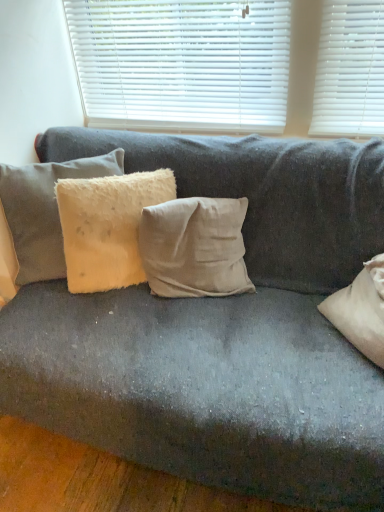
This screenshot has width=384, height=512. What do you see at coordinates (195, 247) in the screenshot?
I see `beige cotton cushion at center, which is counted as the first pillow, starting from the right` at bounding box center [195, 247].

Image resolution: width=384 pixels, height=512 pixels. What do you see at coordinates (44, 211) in the screenshot?
I see `fuzzy beige pillow at left, which appears as the 1th pillow when viewed from the left` at bounding box center [44, 211].

What do you see at coordinates (182, 64) in the screenshot? The width and height of the screenshot is (384, 512). I see `white plastic blinds at upper center` at bounding box center [182, 64].

In order to click on fuzzy beige pillow at center, the 2th pillow from the right in this screenshot , I will do `click(107, 226)`.

Looking at the image, does fuzzy beige pillow at left, which appears as the 1th pillow when viewed from the left, seem bigger or smaller compared to white plastic blinds at upper center?

fuzzy beige pillow at left, which appears as the 1th pillow when viewed from the left, is bigger than white plastic blinds at upper center.

Does point (7, 195) come behind point (143, 61)?

No, (7, 195) is in front of (143, 61).

From their relative heights in the image, would you say fuzzy beige pillow at left, the third pillow when ordered from right to left, is taller or shorter than white plastic blinds at upper center?

Clearly, fuzzy beige pillow at left, the third pillow when ordered from right to left, is shorter compared to white plastic blinds at upper center.

Which is behind, fuzzy beige pillow at left, the third pillow when ordered from right to left, or white plastic blinds at upper center?

white plastic blinds at upper center is behind.

Could you tell me if white plastic blinds at upper center is turned towards fuzzy beige pillow at left, the third pillow when ordered from right to left?

No, white plastic blinds at upper center is not facing towards fuzzy beige pillow at left, the third pillow when ordered from right to left.

How much distance is there between white plastic blinds at upper center and fuzzy beige pillow at left, the third pillow when ordered from right to left?

The distance of white plastic blinds at upper center from fuzzy beige pillow at left, the third pillow when ordered from right to left, is 23.37 inches.

Where is `the 1st pillow located beneath the white plastic blinds at upper center (from a real-world perspective)`? This screenshot has height=512, width=384. the 1st pillow located beneath the white plastic blinds at upper center (from a real-world perspective) is located at coordinates (44, 211).

From the image's perspective, is white plastic blinds at upper center on top of fuzzy beige pillow at left, the third pillow when ordered from right to left?

Yes, from the image's perspective, white plastic blinds at upper center is over fuzzy beige pillow at left, the third pillow when ordered from right to left.

Is beige cotton cushion at center, which is counted as the first pillow, starting from the right, completely or partially outside of fuzzy beige pillow at left, which appears as the 1th pillow when viewed from the left?

Yes, beige cotton cushion at center, which is counted as the first pillow, starting from the right, is located beyond the bounds of fuzzy beige pillow at left, which appears as the 1th pillow when viewed from the left.

Is point (222, 275) closer or farther from the camera than point (56, 241)?

Point (222, 275) is closer to the camera than point (56, 241).

Is beige cotton cushion at center, which is counted as the first pillow, starting from the right, in front of or behind fuzzy beige pillow at left, the third pillow when ordered from right to left, in the image?

beige cotton cushion at center, which is counted as the first pillow, starting from the right, is behind fuzzy beige pillow at left, the third pillow when ordered from right to left.

Can you confirm if beige cotton cushion at center, placed as the 3th pillow when sorted from left to right, is smaller than fuzzy beige pillow at left, the third pillow when ordered from right to left?

Yes, beige cotton cushion at center, placed as the 3th pillow when sorted from left to right, is smaller than fuzzy beige pillow at left, the third pillow when ordered from right to left.

What's the angular difference between white plastic blinds at upper center and beige cotton cushion at center, placed as the 3th pillow when sorted from left to right,'s facing directions?

They differ by 17.4 degrees in their facing directions.

Is white plastic blinds at upper center far away from beige cotton cushion at center, placed as the 3th pillow when sorted from left to right?

white plastic blinds at upper center is actually quite close to beige cotton cushion at center, placed as the 3th pillow when sorted from left to right.

Looking at their sizes, would you say white plastic blinds at upper center is wider or thinner than beige cotton cushion at center, which is counted as the first pillow, starting from the right?

Considering their sizes, white plastic blinds at upper center looks slimmer than beige cotton cushion at center, which is counted as the first pillow, starting from the right.

Can you confirm if white plastic blinds at upper center is smaller than beige cotton cushion at center, placed as the 3th pillow when sorted from left to right?

Yes.

Is fuzzy beige pillow at left, which appears as the 1th pillow when viewed from the left, not near beige cotton cushion at center, which is counted as the first pillow, starting from the right?

fuzzy beige pillow at left, which appears as the 1th pillow when viewed from the left, is near beige cotton cushion at center, which is counted as the first pillow, starting from the right, not far away.

Who is taller, fuzzy beige pillow at left, which appears as the 1th pillow when viewed from the left, or beige cotton cushion at center, placed as the 3th pillow when sorted from left to right?

fuzzy beige pillow at left, which appears as the 1th pillow when viewed from the left, is taller.

Considering the positions of points (22, 182) and (244, 283), is point (22, 182) closer to camera compared to point (244, 283)?

Yes, point (22, 182) is in front of point (244, 283).

From a real-world perspective, between fuzzy beige pillow at left, the third pillow when ordered from right to left, and beige cotton cushion at center, which is counted as the first pillow, starting from the right, who is vertically higher?

In real-world perspective, fuzzy beige pillow at left, the third pillow when ordered from right to left, is above.

Considering the relative positions of fuzzy beige pillow at center, the 2th pillow from the right, and beige cotton cushion at center, placed as the 3th pillow when sorted from left to right, in the image provided, is fuzzy beige pillow at center, the 2th pillow from the right, in front of beige cotton cushion at center, placed as the 3th pillow when sorted from left to right,?

Yes, fuzzy beige pillow at center, the 2th pillow from the right, is closer to the viewer.

Is fuzzy beige pillow at center, the 2th pillow from the right, positioned with its back to beige cotton cushion at center, which is counted as the first pillow, starting from the right?

No, beige cotton cushion at center, which is counted as the first pillow, starting from the right, is not at the back of fuzzy beige pillow at center, the 2th pillow from the right.

From the picture: Who is smaller, fuzzy beige pillow at center, arranged as the 2th pillow when viewed from the left, or beige cotton cushion at center, placed as the 3th pillow when sorted from left to right?

Smaller between the two is beige cotton cushion at center, placed as the 3th pillow when sorted from left to right.

Is fuzzy beige pillow at center, arranged as the 2th pillow when viewed from the left, directly adjacent to beige cotton cushion at center, placed as the 3th pillow when sorted from left to right?

No.

What's the angular difference between fuzzy beige pillow at left, the third pillow when ordered from right to left, and fuzzy beige pillow at center, the 2th pillow from the right,'s facing directions?

The angular difference between fuzzy beige pillow at left, the third pillow when ordered from right to left, and fuzzy beige pillow at center, the 2th pillow from the right, is 9.43 degrees.

How much distance is there between fuzzy beige pillow at left, which appears as the 1th pillow when viewed from the left, and fuzzy beige pillow at center, arranged as the 2th pillow when viewed from the left?

6.09 inches.

Is fuzzy beige pillow at left, the third pillow when ordered from right to left, taller or shorter than fuzzy beige pillow at center, arranged as the 2th pillow when viewed from the left?

fuzzy beige pillow at left, the third pillow when ordered from right to left, is taller than fuzzy beige pillow at center, arranged as the 2th pillow when viewed from the left.

In the scene shown: Between fuzzy beige pillow at left, the third pillow when ordered from right to left, and fuzzy beige pillow at center, arranged as the 2th pillow when viewed from the left, which one appears on the left side from the viewer's perspective?

Positioned to the left is fuzzy beige pillow at left, the third pillow when ordered from right to left.

This screenshot has width=384, height=512. I want to click on window blind located above the fuzzy beige pillow at left, the third pillow when ordered from right to left (from the image's perspective), so click(x=182, y=64).

Identify the location of window blind on the right of the fuzzy beige pillow at left, the third pillow when ordered from right to left. (182, 64).

Estimate the real-world distances between objects in this image. Which object is further from fuzzy beige pillow at center, the 2th pillow from the right, beige cotton cushion at center, placed as the 3th pillow when sorted from left to right, or fuzzy beige pillow at left, the third pillow when ordered from right to left?

The object further to fuzzy beige pillow at center, the 2th pillow from the right, is fuzzy beige pillow at left, the third pillow when ordered from right to left.

From the picture: Looking at the image, which one is located further to fuzzy beige pillow at left, which appears as the 1th pillow when viewed from the left, beige cotton cushion at center, placed as the 3th pillow when sorted from left to right, or white plastic blinds at upper center?

white plastic blinds at upper center is further to fuzzy beige pillow at left, which appears as the 1th pillow when viewed from the left.

Looking at the image, which one is located further to beige cotton cushion at center, placed as the 3th pillow when sorted from left to right, fuzzy beige pillow at center, arranged as the 2th pillow when viewed from the left, or white plastic blinds at upper center?

white plastic blinds at upper center is further to beige cotton cushion at center, placed as the 3th pillow when sorted from left to right.

Considering their positions, is fuzzy beige pillow at left, the third pillow when ordered from right to left, positioned closer to beige cotton cushion at center, placed as the 3th pillow when sorted from left to right, than white plastic blinds at upper center?

Based on the image, fuzzy beige pillow at left, the third pillow when ordered from right to left, appears to be nearer to beige cotton cushion at center, placed as the 3th pillow when sorted from left to right.

Which object lies further to the anchor point fuzzy beige pillow at center, the 2th pillow from the right, fuzzy beige pillow at left, the third pillow when ordered from right to left, or white plastic blinds at upper center?

Based on the image, white plastic blinds at upper center appears to be further to fuzzy beige pillow at center, the 2th pillow from the right.

Based on their spatial positions, is beige cotton cushion at center, which is counted as the first pillow, starting from the right, or fuzzy beige pillow at center, arranged as the 2th pillow when viewed from the left, closer to fuzzy beige pillow at left, the third pillow when ordered from right to left?

Among the two, fuzzy beige pillow at center, arranged as the 2th pillow when viewed from the left, is located nearer to fuzzy beige pillow at left, the third pillow when ordered from right to left.

Based on their spatial positions, is fuzzy beige pillow at left, which appears as the 1th pillow when viewed from the left, or beige cotton cushion at center, placed as the 3th pillow when sorted from left to right, closer to white plastic blinds at upper center?

Based on the image, fuzzy beige pillow at left, which appears as the 1th pillow when viewed from the left, appears to be nearer to white plastic blinds at upper center.

When comparing their distances from white plastic blinds at upper center, does beige cotton cushion at center, which is counted as the first pillow, starting from the right, or fuzzy beige pillow at center, the 2th pillow from the right, seem closer?

The object closer to white plastic blinds at upper center is fuzzy beige pillow at center, the 2th pillow from the right.

Identify the location of pillow between white plastic blinds at upper center and fuzzy beige pillow at center, arranged as the 2th pillow when viewed from the left, vertically. Image resolution: width=384 pixels, height=512 pixels. (44, 211).

At what (x,y) coordinates should I click in order to perform the action: click on pillow between fuzzy beige pillow at left, the third pillow when ordered from right to left, and beige cotton cushion at center, which is counted as the first pillow, starting from the right, from left to right. Please return your answer as a coordinate pair (x, y). Looking at the image, I should click on (107, 226).